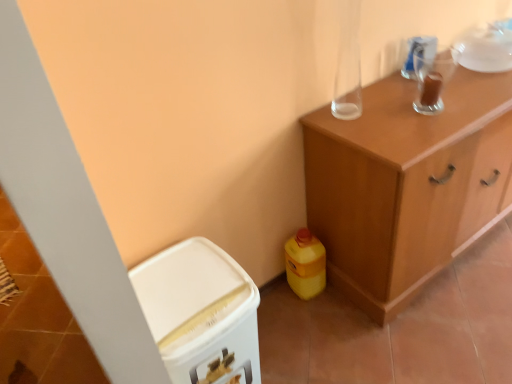
Find the location of a particular element. The image size is (512, 384). free spot to the right of transparent glass cup at upper right is located at coordinates (462, 94).